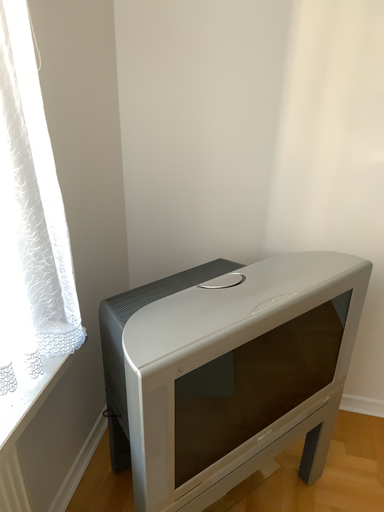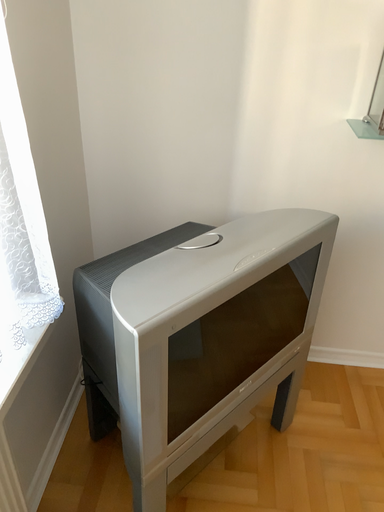
Question: How did the camera likely rotate when shooting the video?

Choices:
 (A) rotated right
 (B) rotated left

Answer: (A)